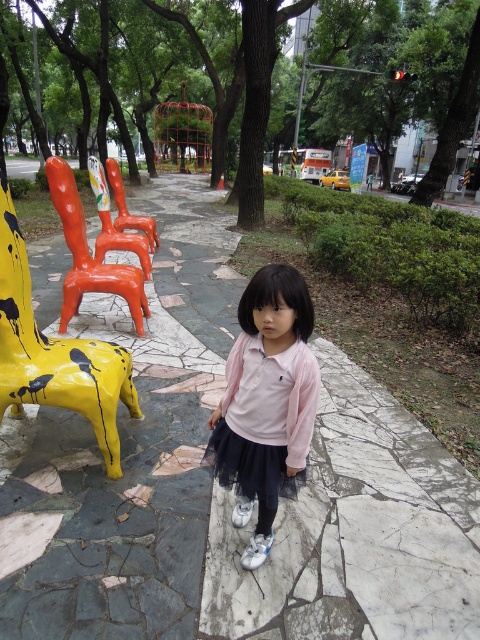
Question: Which point is farther from the camera taking this photo?

Choices:
 (A) (218, 580)
 (B) (272, 484)
 (C) (21, 252)

Answer: (C)

Question: Is pink satin shirt at center closer to the viewer compared to yellow painted plastic chair at left?

Choices:
 (A) no
 (B) yes

Answer: (B)

Question: Estimate the real-world distances between objects in this image. Which object is farther from the pink satin shirt at center?

Choices:
 (A) orange glossy chair at center
 (B) yellow painted plastic chair at left

Answer: (A)

Question: Does yellow painted plastic chair at left come in front of orange glossy chair at center?

Choices:
 (A) no
 (B) yes

Answer: (B)

Question: Which of the following is the farthest from the observer?

Choices:
 (A) white marble pavement at center
 (B) orange glossy chair at center
 (C) orange glossy chair at left
 (D) pink satin shirt at center

Answer: (B)

Question: Can you confirm if white marble pavement at center is wider than orange glossy chair at center?

Choices:
 (A) no
 (B) yes

Answer: (B)